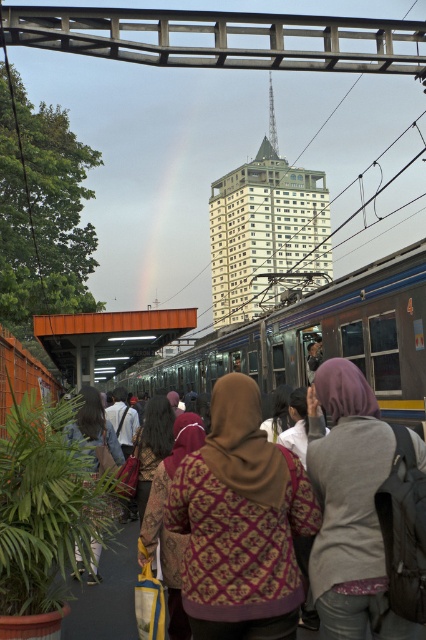
Question: Which object is closer to the camera taking this photo?

Choices:
 (A) gray fleece jacket at center
 (B) metallic silver train at center

Answer: (A)

Question: Does patterned fabric headscarf at center have a smaller size compared to gray fleece jacket at center?

Choices:
 (A) no
 (B) yes

Answer: (A)

Question: Which of these objects is positioned closest to the metallic silver train at center?

Choices:
 (A) gray fleece jacket at center
 (B) patterned fabric headscarf at center

Answer: (B)

Question: Can you confirm if patterned fabric headscarf at center is smaller than metallic silver train at center?

Choices:
 (A) yes
 (B) no

Answer: (A)

Question: Among these points, which one is nearest to the camera?

Choices:
 (A) (293, 630)
 (B) (417, 387)
 (C) (408, 632)

Answer: (C)

Question: Considering the relative positions of patterned fabric headscarf at center and gray fleece jacket at center in the image provided, where is patterned fabric headscarf at center located with respect to gray fleece jacket at center?

Choices:
 (A) left
 (B) right

Answer: (A)